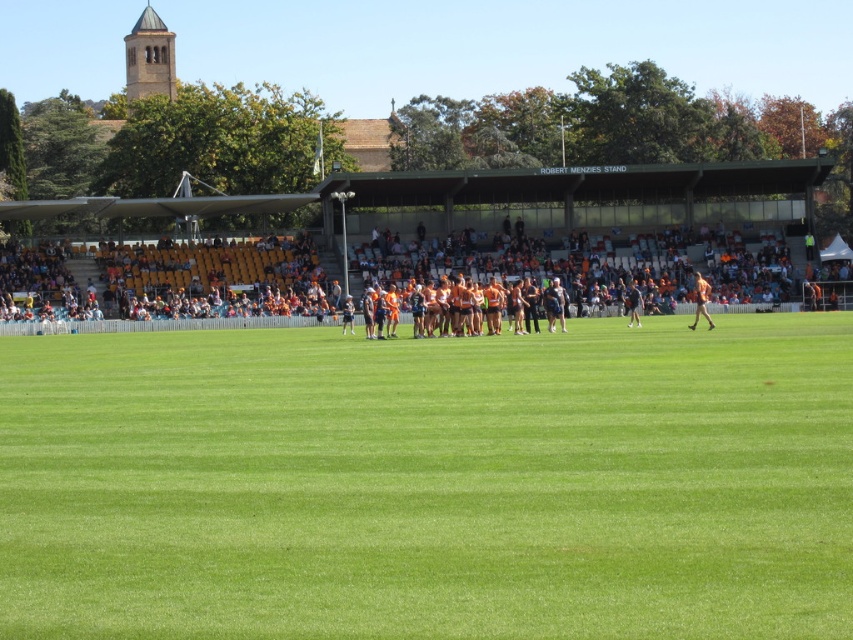
Question: Estimate the real-world distances between objects in this image. Which object is farther from the orange jersey at center?

Choices:
 (A) orange uniformed person at center
 (B) green grass field at center

Answer: (B)

Question: Is green grass field at center above orange jersey at center?

Choices:
 (A) no
 (B) yes

Answer: (A)

Question: Which point is farther to the camera?

Choices:
 (A) orange jersey at center
 (B) orange uniformed person at center

Answer: (B)

Question: Which of the following is the farthest from the observer?

Choices:
 (A) (695, 308)
 (B) (634, 292)
 (C) (583, 419)

Answer: (A)

Question: Is green grass field at center positioned before orange uniformed person at center?

Choices:
 (A) no
 (B) yes

Answer: (B)

Question: In this image, where is orange jersey at center located relative to orange uniformed person at center?

Choices:
 (A) right
 (B) left

Answer: (A)